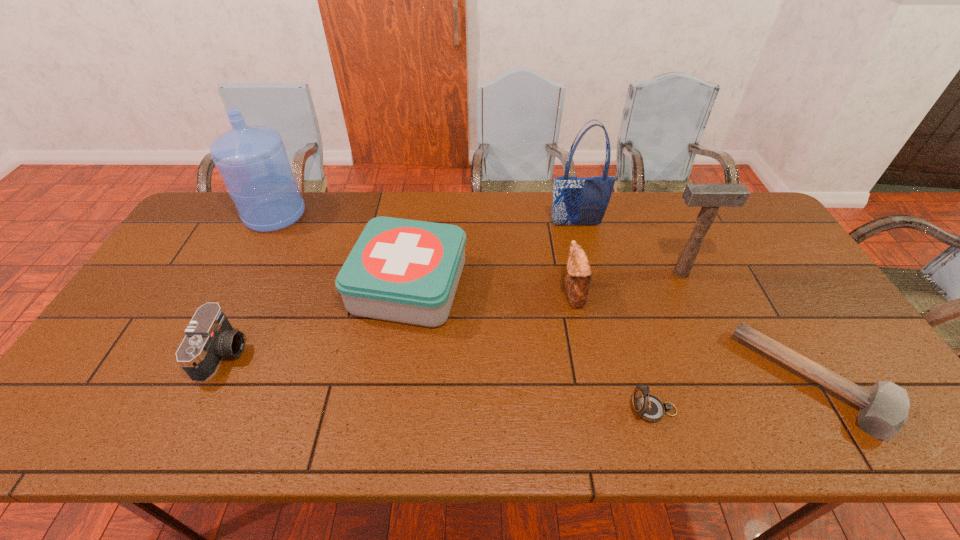
At what (x,y) coordinates should I click in order to perform the action: click on water jug. Please return your answer as a coordinate pair (x, y). The image size is (960, 540). Looking at the image, I should click on (252, 160).

Find the location of a particular element. Image resolution: width=960 pixels, height=540 pixels. shopping bag is located at coordinates (576, 201).

Locate an element on the screen. the third tallest object is located at coordinates (710, 197).

Identify the location of the farther mallet. The height and width of the screenshot is (540, 960). (710, 197).

The width and height of the screenshot is (960, 540). What are the coordinates of `clutch bag` in the screenshot? It's located at (578, 278).

Where is `the sixth object from right to left`? This screenshot has width=960, height=540. the sixth object from right to left is located at coordinates (401, 270).

This screenshot has width=960, height=540. In order to click on the fifth tallest object in this screenshot , I will do `click(401, 270)`.

Find the location of a particular element. Image resolution: width=960 pixels, height=540 pixels. camera is located at coordinates (209, 337).

The height and width of the screenshot is (540, 960). Find the location of `compass`. compass is located at coordinates (648, 407).

Find the location of a particular element. the shorter mallet is located at coordinates (884, 408).